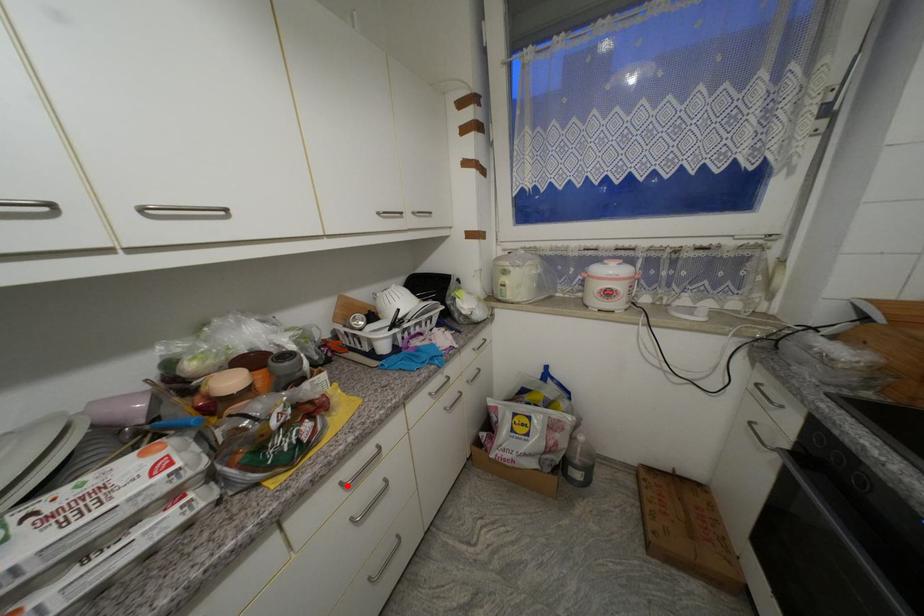
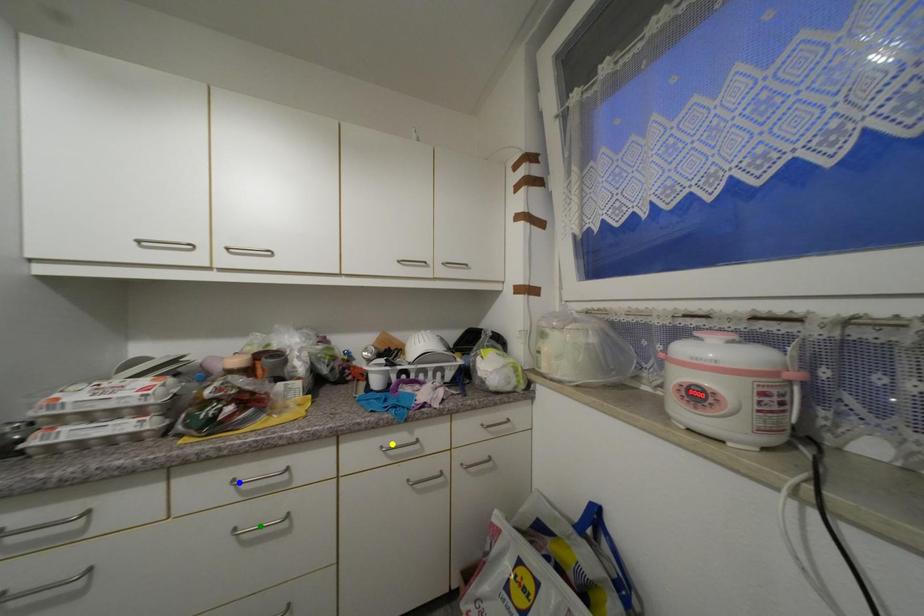
Question: I am providing you with two images of the same scene from different viewpoints. A red point is marked on the first image. You are given multiple points on the second image. Which point in image 2 represents the same 3d spot as the red point in image 1?

Choices:
 (A) blue point
 (B) yellow point
 (C) green point

Answer: (A)